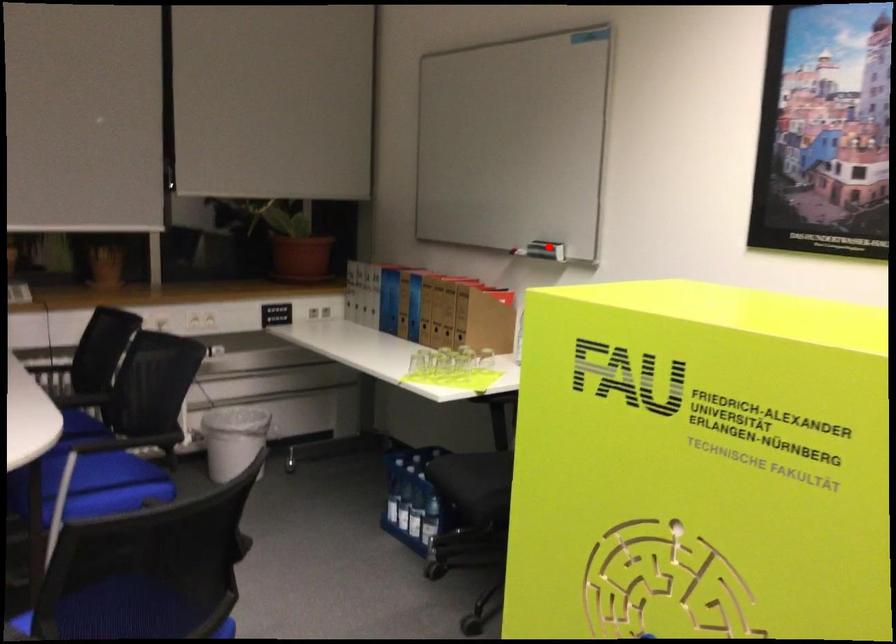
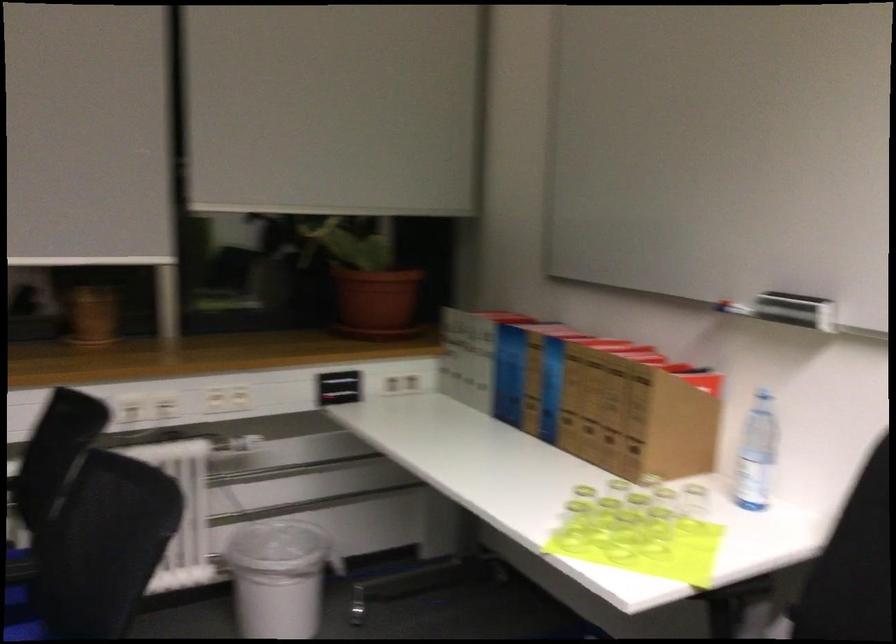
In the second image, find the point that corresponds to the highlighted location in the first image.

(795, 310)